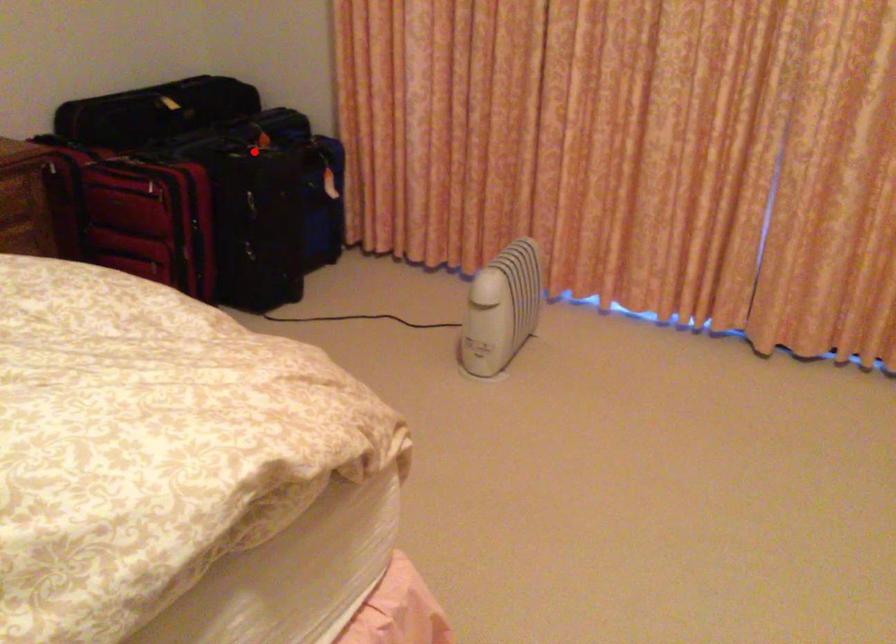
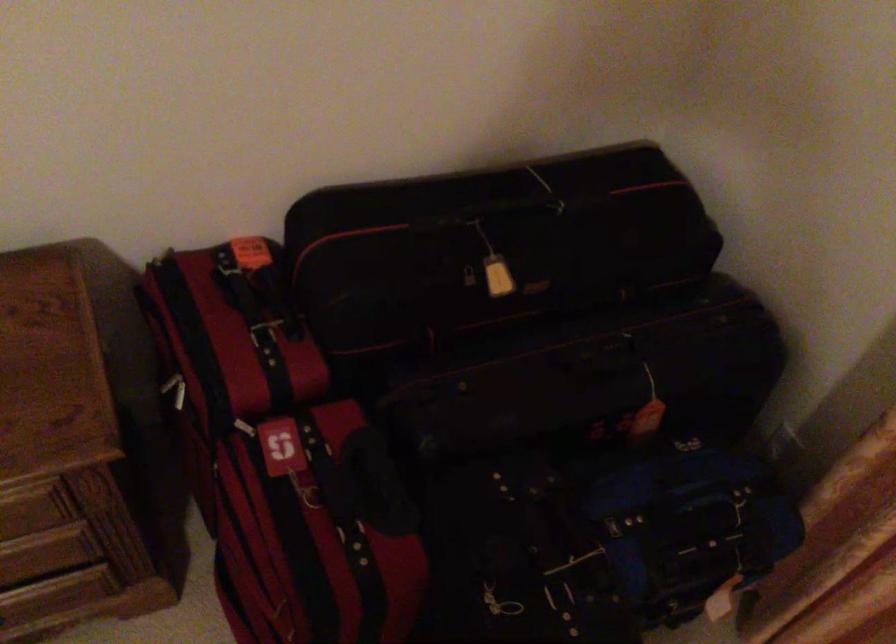
Find the pixel in the second image that matches the highlighted location in the first image.

(556, 552)